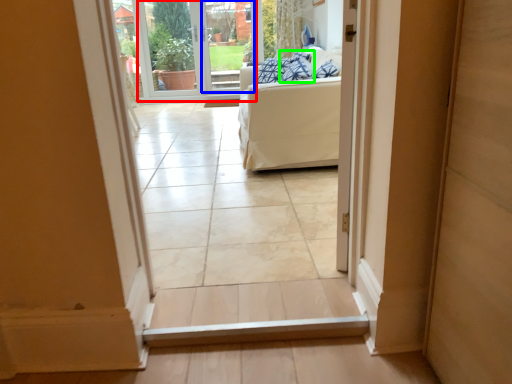
Question: Which is farther away from window screen (highlighted by a red box)? glass door (highlighted by a blue box) or pillow (highlighted by a green box)?

Choices:
 (A) glass door
 (B) pillow

Answer: (B)